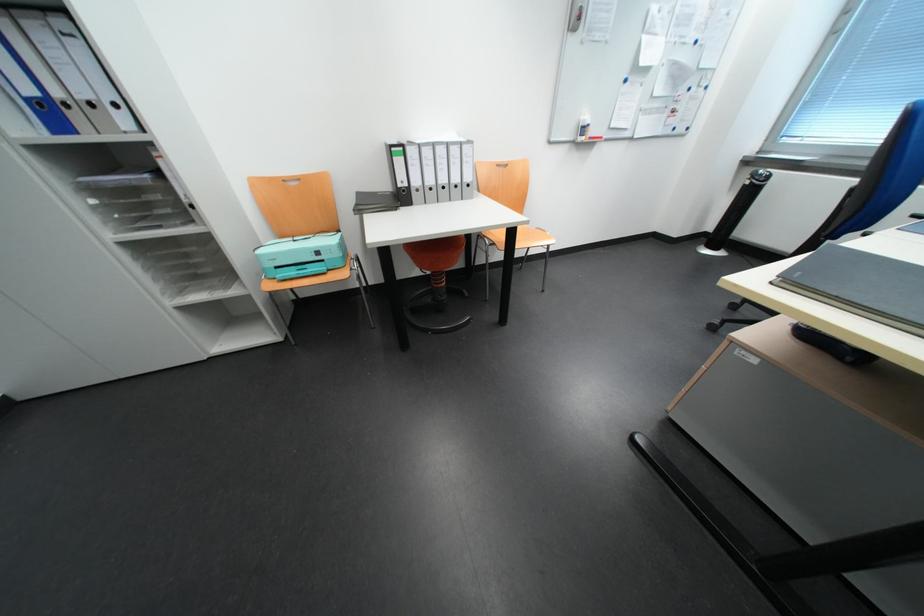
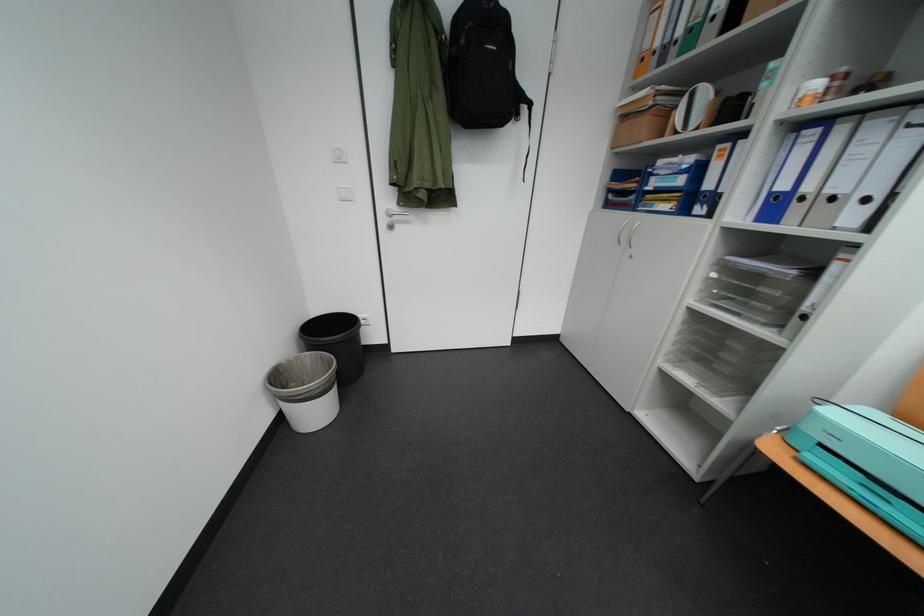
In the second image, find the point that corresponds to pixel 112 103 in the first image.

(861, 197)